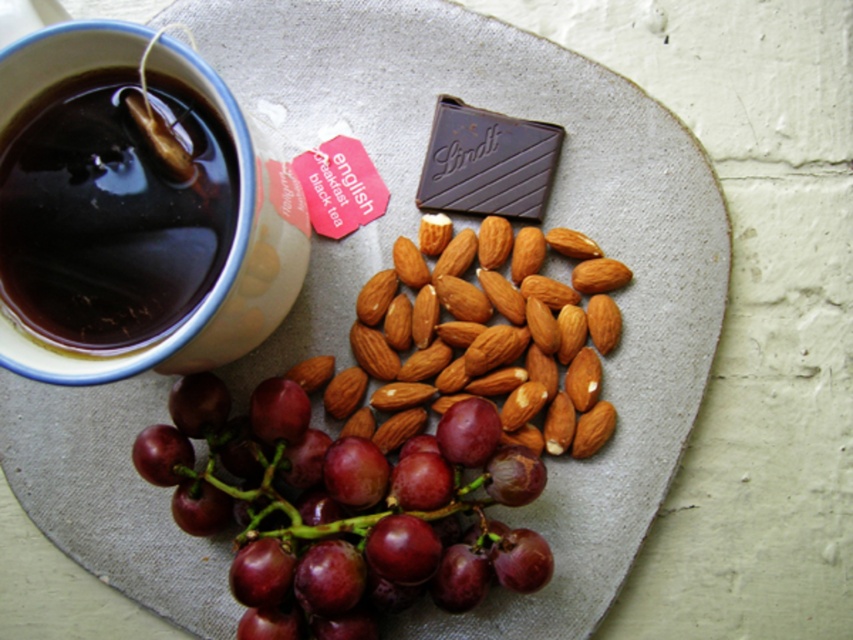
Question: Which object is the closest to the dark brown liquid at upper left?

Choices:
 (A) dark chocolate bar at center
 (B) shiny purple grapes at lower center
 (C) smooth brown almonds at center

Answer: (B)

Question: Which point is closer to the camera?

Choices:
 (A) dark brown liquid at upper left
 (B) smooth brown almonds at center

Answer: (A)

Question: Which point appears closest to the camera in this image?

Choices:
 (A) (534, 200)
 (B) (396, 280)
 (C) (112, 314)
 (D) (357, 525)

Answer: (C)

Question: Is shiny purple grapes at lower center thinner than smooth brown almonds at center?

Choices:
 (A) no
 (B) yes

Answer: (A)

Question: Does dark brown liquid at upper left have a greater width compared to smooth brown almonds at center?

Choices:
 (A) no
 (B) yes

Answer: (A)

Question: In this image, where is dark brown liquid at upper left located relative to dark chocolate bar at center?

Choices:
 (A) below
 (B) above

Answer: (A)